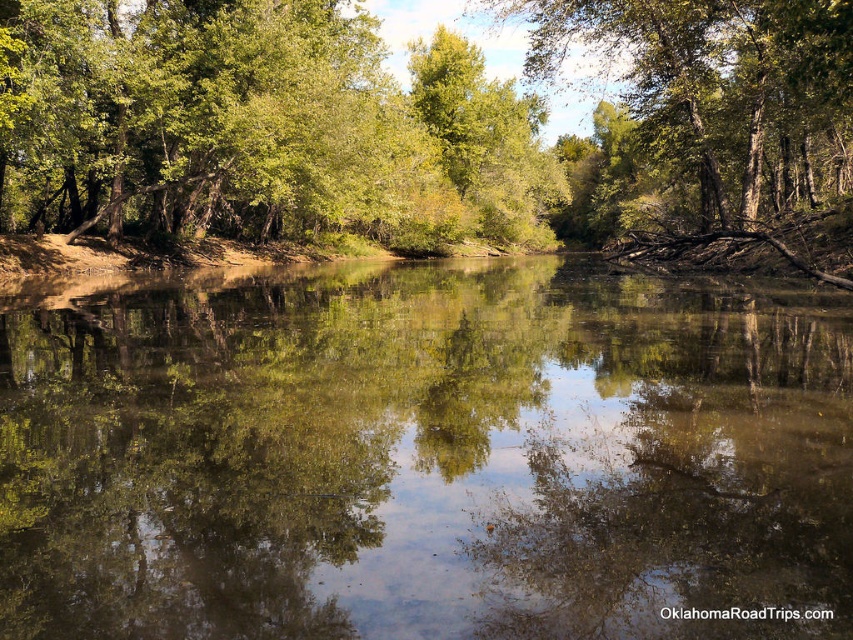
You are standing on the riverbank and see the clear water at center and the green leafy tree at center. Which object is closer to the ground?

The clear water at center is closer to the ground than the green leafy tree at center because it is shorter.

You are standing at the riverbank and see two green leafy trees. One is labeled as the green leafy tree at center and the other as the green leafy tree at upper center. Which tree is shorter?

The green leafy tree at center is shorter than the green leafy tree at upper center.